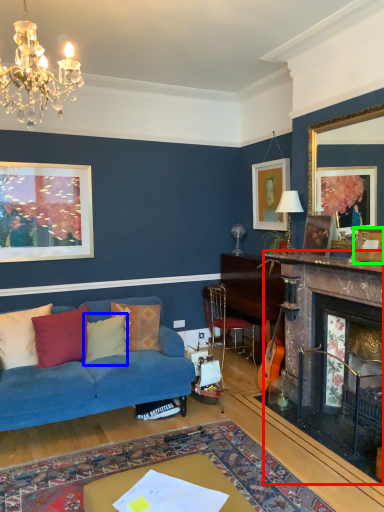
Question: Which object is positioned farthest from fireplace (highlighted by a red box)? Select from pillow (highlighted by a blue box) and picture frame (highlighted by a green box).

Choices:
 (A) pillow
 (B) picture frame

Answer: (A)